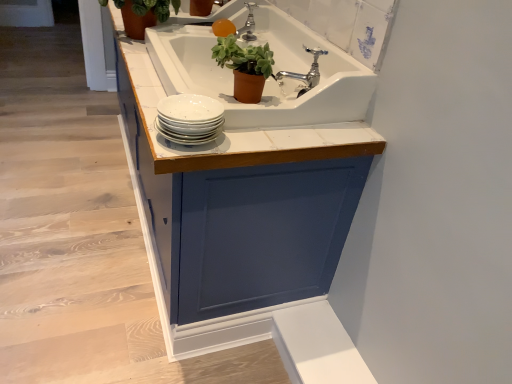
Find the location of a particular element. The height and width of the screenshot is (384, 512). silver metallic tap at upper center, the first tap positioned from the back is located at coordinates [248, 25].

You are a GUI agent. You are given a task and a screenshot of the screen. Output one action in this format:
    pyautogui.click(x=<x>, y=<y>)
    Task: Click on the white glossy plates at center
    
    Given the screenshot: What is the action you would take?
    pyautogui.click(x=189, y=119)

The height and width of the screenshot is (384, 512). Find the location of `white glossy cabinet at upper center`. white glossy cabinet at upper center is located at coordinates (80, 236).

Image resolution: width=512 pixels, height=384 pixels. I want to click on silver metallic tap at upper center, positioned as the second tap in front-to-back order, so click(x=248, y=25).

Is blue painted cabinet at center placed right next to chrome metallic faucet at upper center, which appears as the first tap when ordered from the bottom?

No, blue painted cabinet at center is not touching chrome metallic faucet at upper center, which appears as the first tap when ordered from the bottom.

Is blue painted cabinet at center aimed at chrome metallic faucet at upper center, acting as the first tap starting from the right?

No, blue painted cabinet at center does not turn towards chrome metallic faucet at upper center, acting as the first tap starting from the right.

From a real-world perspective, is blue painted cabinet at center located beneath chrome metallic faucet at upper center, acting as the first tap starting from the right?

Yes.

Does blue painted cabinet at center appear on the left side of white ceramic sink at upper center?

Correct, you'll find blue painted cabinet at center to the left of white ceramic sink at upper center.

Considering the relative sizes of blue painted cabinet at center and white ceramic sink at upper center in the image provided, is blue painted cabinet at center wider than white ceramic sink at upper center?

Indeed, blue painted cabinet at center has a greater width compared to white ceramic sink at upper center.

Between blue painted cabinet at center and white ceramic sink at upper center, which one has smaller size?

white ceramic sink at upper center.

In the scene shown: Can you confirm if silver metallic tap at upper center, acting as the 2th tap starting from the right, is bigger than green matte plant pot at upper center, the 2th houseplant when ordered from top to bottom?

Incorrect, silver metallic tap at upper center, acting as the 2th tap starting from the right, is not larger than green matte plant pot at upper center, the 2th houseplant when ordered from top to bottom.

Is silver metallic tap at upper center, marked as the first tap in a left-to-right arrangement, not near green matte plant pot at upper center, the 2th houseplant when ordered from top to bottom?

They are positioned close to each other.

Is silver metallic tap at upper center, which is the 1th tap in top-to-bottom order, taller than green matte plant pot at upper center, arranged as the 2th houseplant when viewed from the back?

No.

Is the position of silver metallic tap at upper center, acting as the 2th tap starting from the right, more distant than that of green matte plant pot at upper center, arranged as the 2th houseplant when viewed from the back?

Yes, silver metallic tap at upper center, acting as the 2th tap starting from the right, is behind green matte plant pot at upper center, arranged as the 2th houseplant when viewed from the back.

Can you tell me how much chrome metallic faucet at upper center, positioned as the first tap in front-to-back order, and white glossy plates at center differ in facing direction?

The angle between the facing direction of chrome metallic faucet at upper center, positioned as the first tap in front-to-back order, and the facing direction of white glossy plates at center is 34.5 degrees.

Consider the image. Is white glossy plates at center completely or partially inside chrome metallic faucet at upper center, which is counted as the second tap, starting from the back?

That's incorrect, white glossy plates at center is not inside chrome metallic faucet at upper center, which is counted as the second tap, starting from the back.

The image size is (512, 384). I want to click on the 1st tap directly above the white glossy plates at center (from a real-world perspective), so click(x=307, y=73).

Considering the sizes of objects chrome metallic faucet at upper center, which appears as the first tap when ordered from the bottom, and white glossy plates at center in the image provided, who is thinner, chrome metallic faucet at upper center, which appears as the first tap when ordered from the bottom, or white glossy plates at center?

With smaller width is chrome metallic faucet at upper center, which appears as the first tap when ordered from the bottom.

From the white glossy plates at center, count 2nd houseplants backward and point to it. Please provide its 2D coordinates.

[(144, 14)]

Which is behind, green matte plant at upper left, which is counted as the 2th houseplant, starting from the bottom, or white glossy plates at center?

green matte plant at upper left, which is counted as the 2th houseplant, starting from the bottom, is further from the camera.

From the image's perspective, is green matte plant at upper left, marked as the second houseplant in a right-to-left arrangement, on white glossy plates at center?

Yes, from the image's perspective, green matte plant at upper left, marked as the second houseplant in a right-to-left arrangement, is on top of white glossy plates at center.

Can you confirm if green matte plant at upper left, marked as the second houseplant in a right-to-left arrangement, is smaller than white glossy plates at center?

Actually, green matte plant at upper left, marked as the second houseplant in a right-to-left arrangement, might be larger than white glossy plates at center.

What's the angular difference between blue painted cabinet at center and white glossy cabinet at upper center's facing directions?

The angular difference between blue painted cabinet at center and white glossy cabinet at upper center is 89.7 degrees.

Looking at this image, considering their positions, is blue painted cabinet at center located in front of or behind white glossy cabinet at upper center?

Clearly, blue painted cabinet at center is in front of white glossy cabinet at upper center.

From a real-world perspective, is blue painted cabinet at center on white glossy cabinet at upper center?

Yes, from a real-world perspective, blue painted cabinet at center is over white glossy cabinet at upper center

Considering the sizes of objects blue painted cabinet at center and white glossy cabinet at upper center in the image provided, who is shorter, blue painted cabinet at center or white glossy cabinet at upper center?

white glossy cabinet at upper center is shorter.

Measure the distance between blue painted cabinet at center and green matte plant pot at upper center, arranged as the 2th houseplant when viewed from the left.

A distance of 14.86 inches exists between blue painted cabinet at center and green matte plant pot at upper center, arranged as the 2th houseplant when viewed from the left.

Is blue painted cabinet at center taller than green matte plant pot at upper center, the 1th houseplant in the bottom-to-top sequence?

Indeed, blue painted cabinet at center has a greater height compared to green matte plant pot at upper center, the 1th houseplant in the bottom-to-top sequence.

Relative to green matte plant pot at upper center, arranged as the 2th houseplant when viewed from the left, is blue painted cabinet at center in front or behind?

Clearly, blue painted cabinet at center is in front of green matte plant pot at upper center, arranged as the 2th houseplant when viewed from the left.

Is blue painted cabinet at center wider or thinner than green matte plant pot at upper center, the 1th houseplant in the bottom-to-top sequence?

blue painted cabinet at center is wider than green matte plant pot at upper center, the 1th houseplant in the bottom-to-top sequence.

This screenshot has width=512, height=384. Identify the location of the 1st tap positioned above the blue painted cabinet at center (from a real-world perspective). pos(307,73).

Image resolution: width=512 pixels, height=384 pixels. In order to click on cabinetry on the left of white ceramic sink at upper center in this screenshot , I will do `click(250, 195)`.

Based on their spatial positions, is white glossy plates at center or white ceramic sink at upper center closer to silver metallic tap at upper center, marked as the first tap in a left-to-right arrangement?

white ceramic sink at upper center.

Which object lies further to the anchor point green matte plant pot at upper center, the 2th houseplant when ordered from top to bottom, blue painted cabinet at center or green matte plant at upper left, which appears as the 1th houseplant when viewed from the left?

Based on the image, green matte plant at upper left, which appears as the 1th houseplant when viewed from the left, appears to be further to green matte plant pot at upper center, the 2th houseplant when ordered from top to bottom.

Looking at the image, which one is located further to blue painted cabinet at center, green matte plant at upper left, which is counted as the 2th houseplant, starting from the bottom, or white glossy plates at center?

green matte plant at upper left, which is counted as the 2th houseplant, starting from the bottom.

Which object lies nearer to the anchor point white glossy plates at center, blue painted cabinet at center or chrome metallic faucet at upper center, which ranks as the second tap in left-to-right order?

The object closer to white glossy plates at center is blue painted cabinet at center.

Which object lies nearer to the anchor point silver metallic tap at upper center, which is the 1th tap in top-to-bottom order, white glossy cabinet at upper center or white glossy plates at center?

Based on the image, white glossy plates at center appears to be nearer to silver metallic tap at upper center, which is the 1th tap in top-to-bottom order.

Which object lies nearer to the anchor point silver metallic tap at upper center, which ranks as the 2th tap in bottom-to-top order, chrome metallic faucet at upper center, which ranks as the second tap in left-to-right order, or green matte plant at upper left, which is the second houseplant in front-to-back order?

The object closer to silver metallic tap at upper center, which ranks as the 2th tap in bottom-to-top order, is green matte plant at upper left, which is the second houseplant in front-to-back order.

In the scene shown: Based on their spatial positions, is white glossy plates at center or white glossy cabinet at upper center further from chrome metallic faucet at upper center, acting as the first tap starting from the right?

white glossy cabinet at upper center is further to chrome metallic faucet at upper center, acting as the first tap starting from the right.

Looking at the image, which one is located closer to silver metallic tap at upper center, positioned as the second tap in front-to-back order, white glossy cabinet at upper center or chrome metallic faucet at upper center, which appears as the first tap when ordered from the bottom?

chrome metallic faucet at upper center, which appears as the first tap when ordered from the bottom, lies closer to silver metallic tap at upper center, positioned as the second tap in front-to-back order, than the other object.

What are the coordinates of `cabinetry between white ceramic sink at upper center and white glossy plates at center vertically` in the screenshot? It's located at (250, 195).

The image size is (512, 384). I want to click on houseplant between white glossy cabinet at upper center and silver metallic tap at upper center, which is the 1th tap in top-to-bottom order, so click(x=144, y=14).

Locate an element on the screen. cabinetry located between white glossy cabinet at upper center and chrome metallic faucet at upper center, which appears as the first tap when ordered from the bottom, in the left-right direction is located at coordinates (250, 195).

Where is `tap between white glossy cabinet at upper center and chrome metallic faucet at upper center, acting as the first tap starting from the right, from left to right`? Image resolution: width=512 pixels, height=384 pixels. tap between white glossy cabinet at upper center and chrome metallic faucet at upper center, acting as the first tap starting from the right, from left to right is located at coordinates (248, 25).